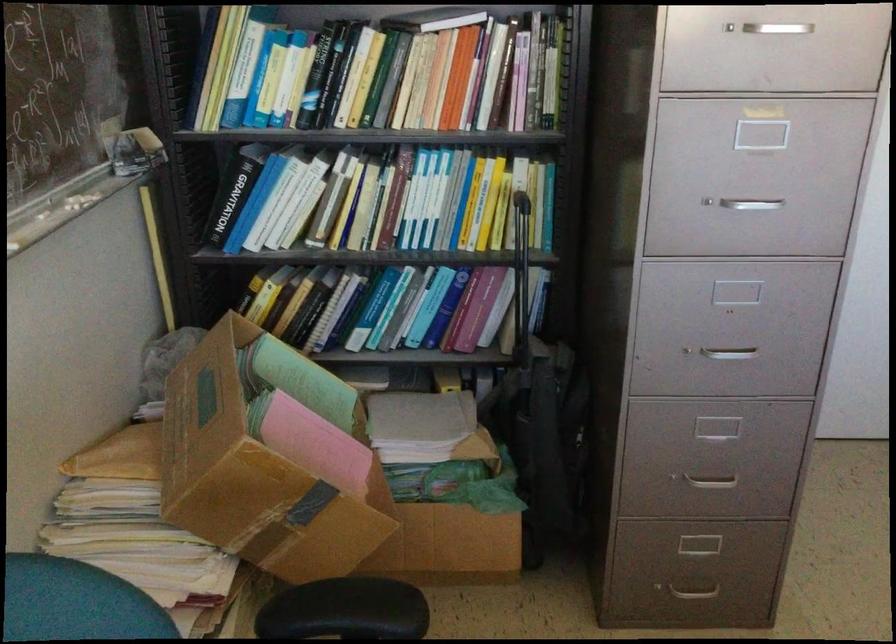
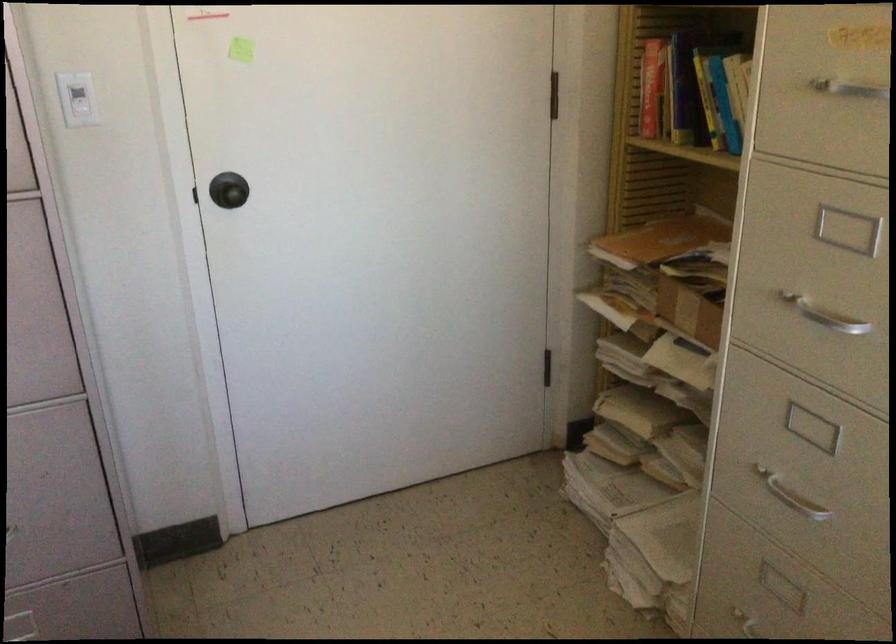
Question: Based on the continuous images, in which direction is the camera rotating? Reply with the corresponding letter.

Choices:
 (A) Left
 (B) Right
 (C) Up
 (D) Down

Answer: (B)